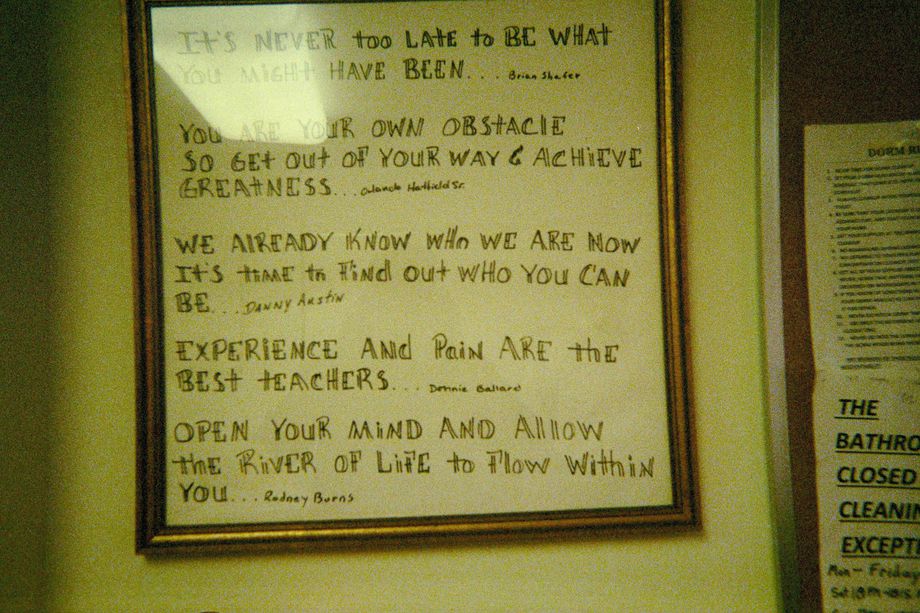
Find the location of a particular element. The image size is (920, 613). ceiling light in reflection is located at coordinates [261, 97].